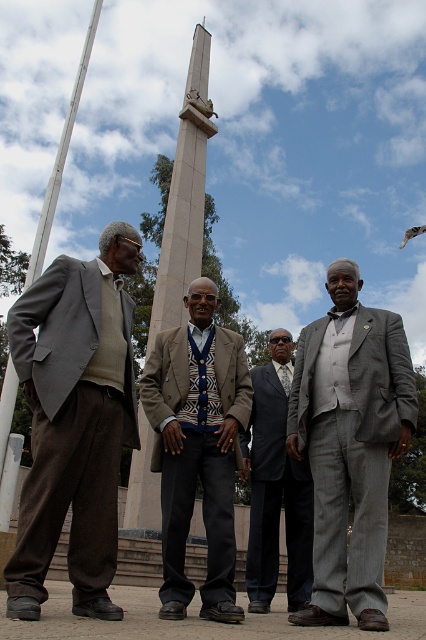
Looking at this image, who is positioned more to the left, matte gray suit at left or smooth stone obelisk at center?

Positioned to the left is matte gray suit at left.

At what (x,y) coordinates should I click in order to perform the action: click on matte gray suit at left. Please return your answer as a coordinate pair (x, y). Looking at the image, I should click on (74, 420).

Does dark gray suit at center have a lesser height compared to smooth stone obelisk at center?

Yes.

Who is positioned more to the left, dark gray suit at center or smooth stone obelisk at center?

Positioned to the left is smooth stone obelisk at center.

Who is more distant from viewer, (267, 413) or (184, 237)?

Point (184, 237)

Where is `dark gray suit at center`? The height and width of the screenshot is (640, 426). dark gray suit at center is located at coordinates pos(276,486).

Can you confirm if matte gray suit at left is positioned below dark gray suit at center?

No, matte gray suit at left is not below dark gray suit at center.

Which is in front, point (22, 307) or point (270, 435)?

Point (22, 307) is in front.

Does point (22, 618) come farther from viewer compared to point (247, 593)?

That is False.

Where is `matte gray suit at left`? matte gray suit at left is located at coordinates (74, 420).